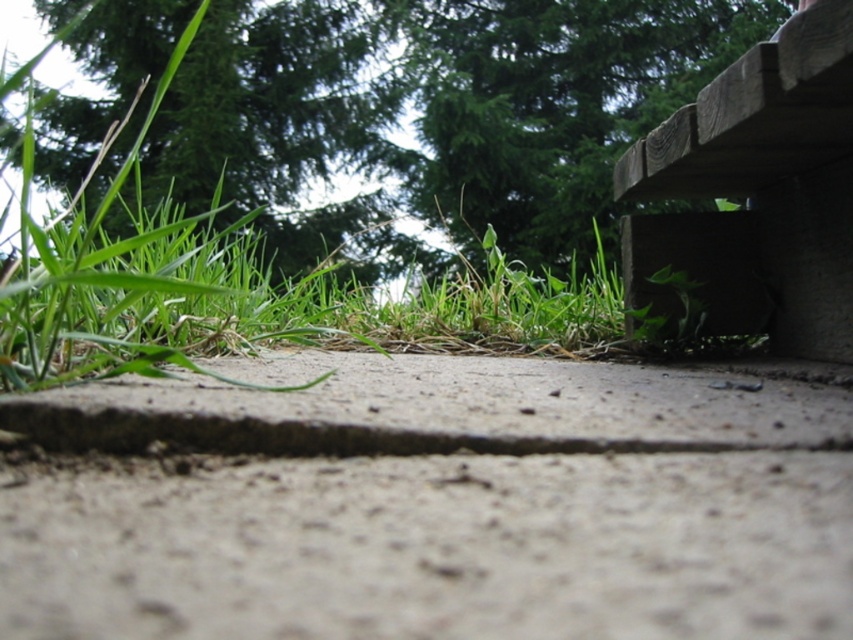
Question: Does gray concrete at center appear on the right side of wooden bench at upper right?

Choices:
 (A) no
 (B) yes

Answer: (A)

Question: Which point appears farthest from the camera in this image?

Choices:
 (A) (607, 570)
 (B) (149, 42)
 (C) (717, 296)

Answer: (B)

Question: Among these objects, which one is farthest from the camera?

Choices:
 (A) green leafy tree at upper center
 (B) wooden bench at upper right
 (C) gray concrete at center

Answer: (A)

Question: From the image, what is the correct spatial relationship of gray concrete at center in relation to green leafy tree at upper center?

Choices:
 (A) above
 (B) below

Answer: (B)

Question: Which point is closer to the camera taking this photo?

Choices:
 (A) (842, 54)
 (B) (286, 362)

Answer: (A)

Question: Can you confirm if green leafy tree at upper center is positioned above wooden bench at upper right?

Choices:
 (A) yes
 (B) no

Answer: (A)